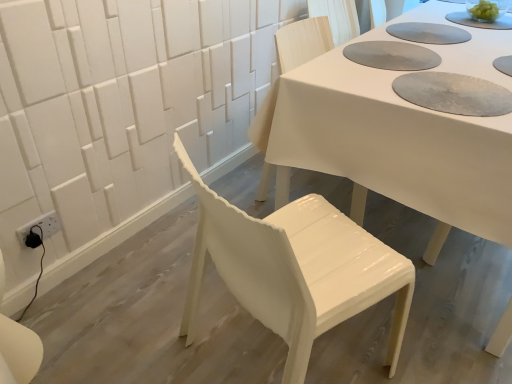
Question: Does white glossy chair at center, the 1th chair viewed from the back, appear on the right side of white glossy chair at center, which ranks as the first chair in front-to-back order?

Choices:
 (A) yes
 (B) no

Answer: (A)

Question: Does white glossy chair at center, the 2th chair in the front-to-back sequence, have a lesser height compared to white glossy chair at center, which ranks as the first chair in front-to-back order?

Choices:
 (A) yes
 (B) no

Answer: (B)

Question: Considering the relative positions of white glossy chair at center, the 2th chair in the front-to-back sequence, and white glossy chair at center, which ranks as the first chair in front-to-back order, in the image provided, is white glossy chair at center, the 2th chair in the front-to-back sequence, to the left of white glossy chair at center, which ranks as the first chair in front-to-back order, from the viewer's perspective?

Choices:
 (A) no
 (B) yes

Answer: (A)

Question: Is white glossy chair at center, the 2th chair in the front-to-back sequence, positioned before white glossy chair at center, the second chair positioned from the back?

Choices:
 (A) yes
 (B) no

Answer: (B)

Question: Does white glossy chair at center, the 2th chair in the front-to-back sequence, have a smaller size compared to white glossy chair at center, which ranks as the first chair in front-to-back order?

Choices:
 (A) no
 (B) yes

Answer: (B)

Question: From the image's perspective, is white glossy table at center positioned above or below textured gray paper plate at upper center?

Choices:
 (A) above
 (B) below

Answer: (B)

Question: Is white glossy table at center in front of or behind textured gray paper plate at upper center in the image?

Choices:
 (A) behind
 (B) front

Answer: (B)

Question: Considering the positions of point tap(503, 150) and point tap(421, 66), is point tap(503, 150) closer or farther from the camera than point tap(421, 66)?

Choices:
 (A) farther
 (B) closer

Answer: (B)

Question: In terms of width, does white glossy table at center look wider or thinner when compared to textured gray paper plate at upper center?

Choices:
 (A) wide
 (B) thin

Answer: (A)

Question: Looking at the image, does white glossy chair at center, which ranks as the first chair in front-to-back order, seem bigger or smaller compared to white glossy table at center?

Choices:
 (A) small
 (B) big

Answer: (A)

Question: From their relative heights in the image, would you say white glossy chair at center, the second chair positioned from the back, is taller or shorter than white glossy table at center?

Choices:
 (A) tall
 (B) short

Answer: (A)

Question: Is point (334, 319) positioned closer to the camera than point (384, 190)?

Choices:
 (A) closer
 (B) farther

Answer: (A)

Question: From the image's perspective, is white glossy chair at center, which ranks as the first chair in front-to-back order, positioned above or below white glossy table at center?

Choices:
 (A) above
 (B) below

Answer: (B)

Question: Is white glossy chair at center, the 2th chair in the front-to-back sequence, wider or thinner than white glossy chair at center, the second chair positioned from the back?

Choices:
 (A) thin
 (B) wide

Answer: (A)

Question: Considering the positions of white glossy chair at center, the 2th chair in the front-to-back sequence, and white glossy chair at center, the second chair positioned from the back, in the image, is white glossy chair at center, the 2th chair in the front-to-back sequence, bigger or smaller than white glossy chair at center, the second chair positioned from the back,?

Choices:
 (A) big
 (B) small

Answer: (B)